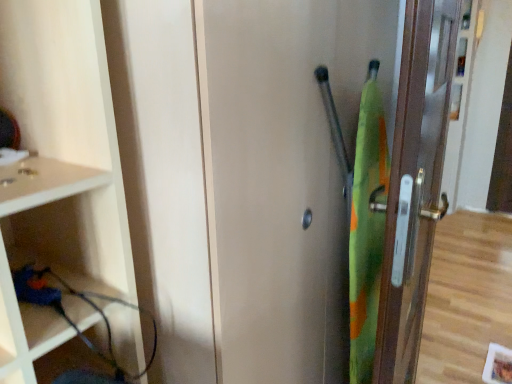
Question: Choose the correct answer: Is metallic gold door at right inside green fabric screen door at right or outside it?

Choices:
 (A) inside
 (B) outside

Answer: (B)

Question: From a real-world perspective, is metallic gold door at right physically located above or below green fabric screen door at right?

Choices:
 (A) above
 (B) below

Answer: (A)

Question: In the image, is metallic gold door at right on the left side or the right side of green fabric screen door at right?

Choices:
 (A) right
 (B) left

Answer: (A)

Question: From a real-world perspective, is green fabric screen door at right physically located above or below metallic gold door at right?

Choices:
 (A) below
 (B) above

Answer: (A)

Question: Relative to metallic gold door at right, is green fabric screen door at right in front or behind?

Choices:
 (A) front
 (B) behind

Answer: (A)

Question: Which is correct: green fabric screen door at right is inside metallic gold door at right, or outside of it?

Choices:
 (A) outside
 (B) inside

Answer: (A)

Question: Is point (313, 344) closer or farther from the camera than point (415, 372)?

Choices:
 (A) farther
 (B) closer

Answer: (B)